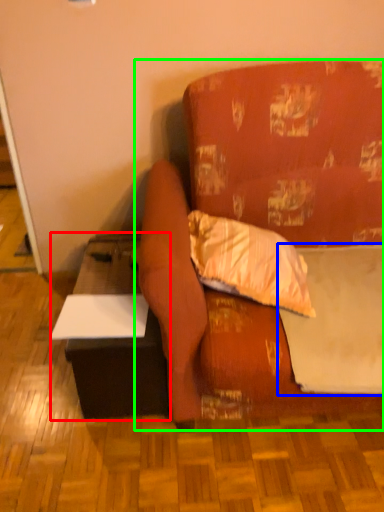
Question: Based on their relative distances, which object is farther from table (highlighted by a red box)? Choose from sheet (highlighted by a blue box) and studio couch (highlighted by a green box).

Choices:
 (A) sheet
 (B) studio couch

Answer: (A)